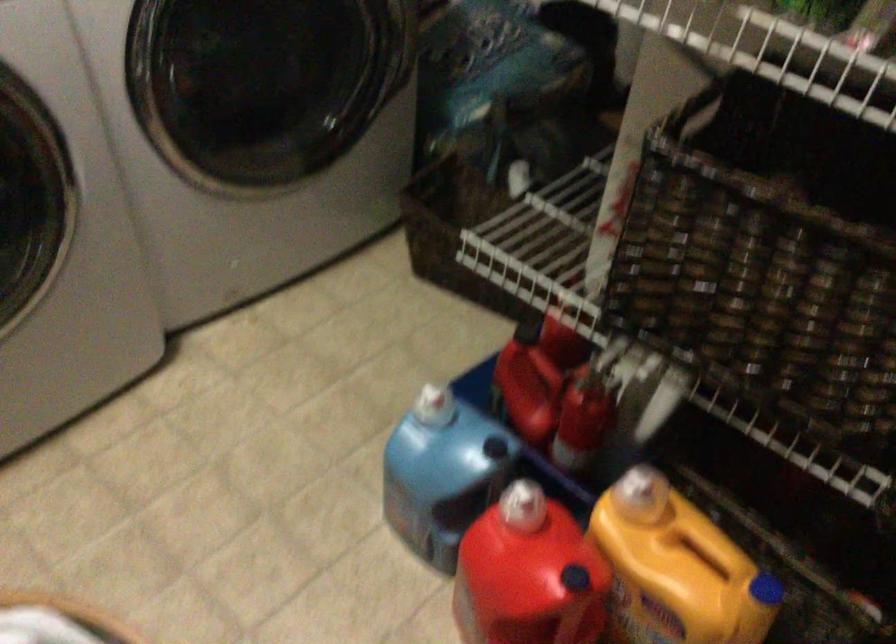
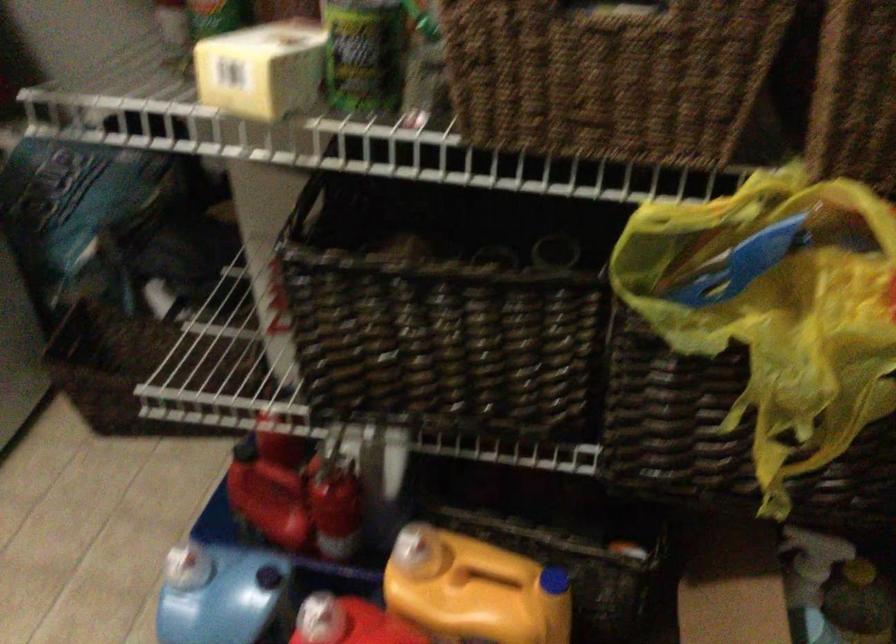
The point at [558,316] is marked in the first image. Where is the corresponding point in the second image?

(269, 426)